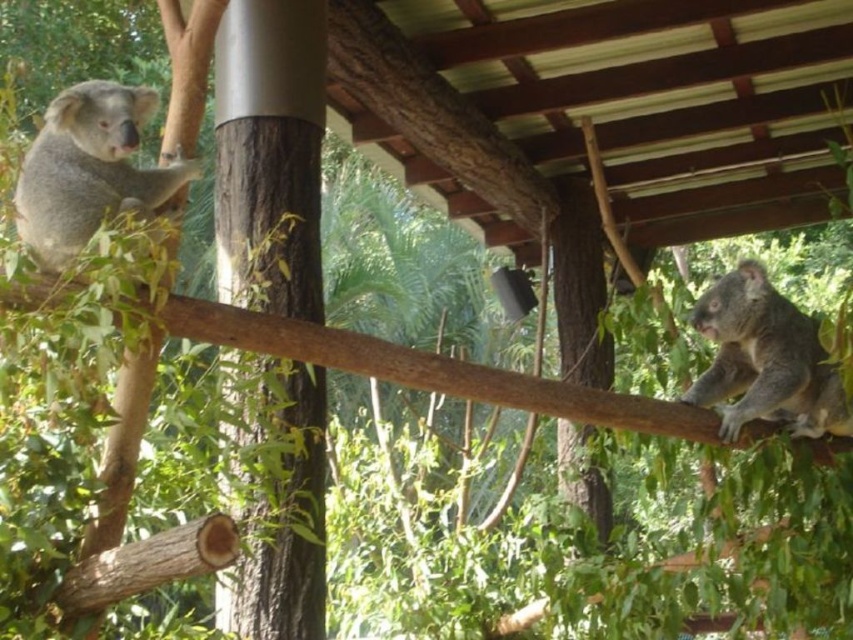
You are a zookeeper standing in front of the enclosure and want to feed the gray furry koala at upper left. The feeding tool you have can reach up to 8 feet. Will you be able to reach the koala with your tool?

The distance between the gray furry koala at upper left and the viewer is 9.64 feet, which is beyond the 8 feet reach of the feeding tool. Therefore, you cannot reach the koala with your current tool.

Looking at this image, you are a zookeeper trying to locate two specific points in the image for habitat maintenance. The first point is at coordinate point (x=131, y=170) and the second is at point (x=762, y=413). Which point is closer to you?

Point (x=131, y=170) is closer to the viewer than point (x=762, y=413).

Consider the image. You are standing at the camera position and want to take a photo of the koala at point (129, 115). If your camera has a focal length of 50mm and you need the koala to be 2 meters away from the camera to focus properly, is the koala within the required distance?

The point (129, 115) is 3.11 meters from the camera, which is farther than the required 2 meters. Therefore, the koala is out of the required focusing distance.